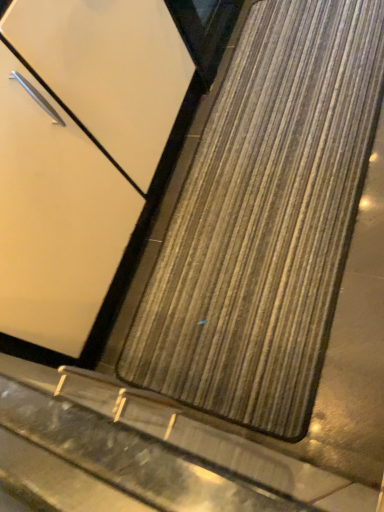
Question: From a real-world perspective, is matte white door at center above or below wooden mat at center?

Choices:
 (A) below
 (B) above

Answer: (B)

Question: Is matte white door at center bigger or smaller than wooden mat at center?

Choices:
 (A) small
 (B) big

Answer: (B)

Question: Is matte white door at center in front of or behind wooden mat at center in the image?

Choices:
 (A) behind
 (B) front

Answer: (B)

Question: In the image, is wooden mat at center positioned in front of or behind matte white door at center?

Choices:
 (A) front
 (B) behind

Answer: (B)

Question: Is wooden mat at center wider or thinner than matte white door at center?

Choices:
 (A) wide
 (B) thin

Answer: (A)

Question: From the image's perspective, is wooden mat at center located above or below matte white door at center?

Choices:
 (A) above
 (B) below

Answer: (B)

Question: Is wooden mat at center inside or outside of matte white door at center?

Choices:
 (A) inside
 (B) outside

Answer: (B)